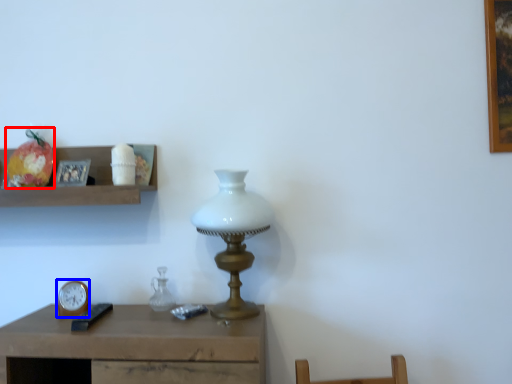
Question: Among these objects, which one is nearest to the camera, fruit (highlighted by a red box) or clock (highlighted by a blue box)?

Choices:
 (A) fruit
 (B) clock

Answer: (B)